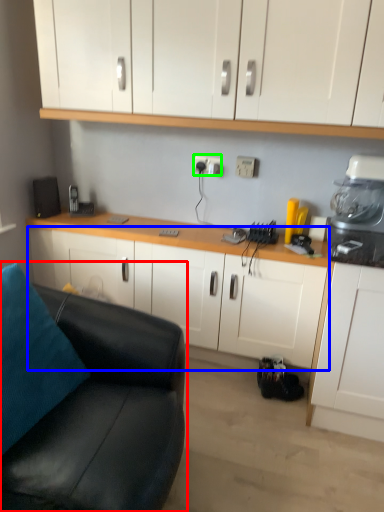
Question: Which is farther away from studio couch (highlighted by a red box)? cabinetry (highlighted by a blue box) or electric outlet (highlighted by a green box)?

Choices:
 (A) cabinetry
 (B) electric outlet

Answer: (B)